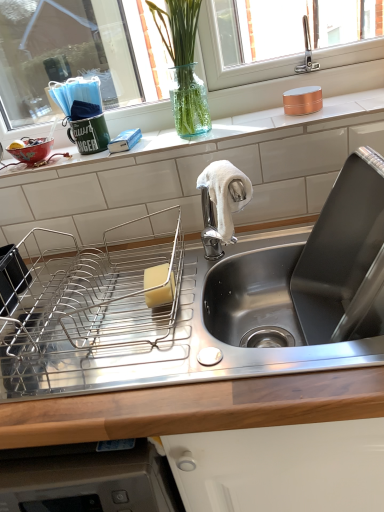
Locate an element on the screen. The width and height of the screenshot is (384, 512). free location to the right of transparent glass vase at upper center is located at coordinates (263, 118).